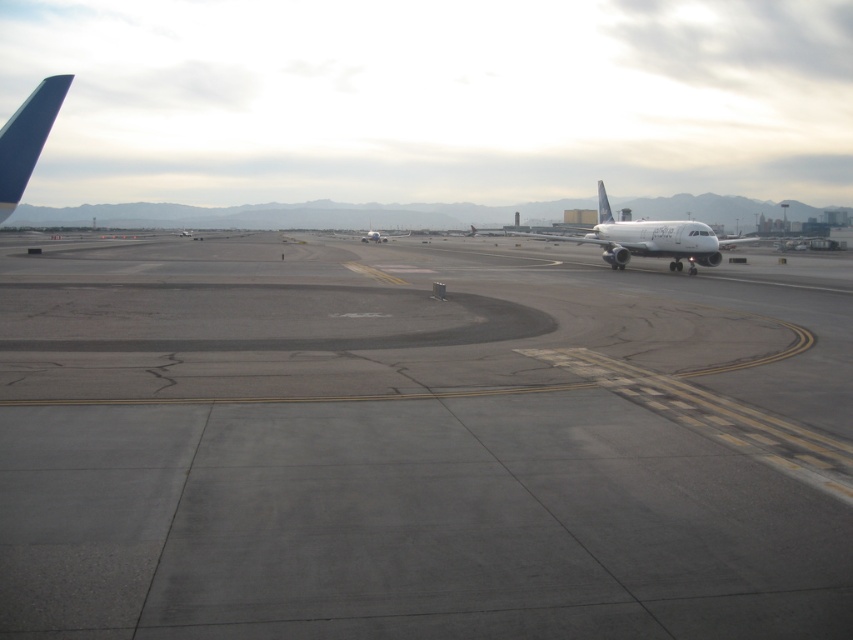
Does gray asphalt runway at center have a greater height compared to white glossy airplane at center?

No.

How distant is gray asphalt runway at center from white glossy airplane at center?

gray asphalt runway at center is 49.11 feet away from white glossy airplane at center.

At what (x,y) coordinates should I click in order to perform the action: click on gray asphalt runway at center. Please return your answer as a coordinate pair (x, y). The image size is (853, 640). Looking at the image, I should click on (419, 442).

This screenshot has height=640, width=853. Find the location of `gray asphalt runway at center`. gray asphalt runway at center is located at coordinates point(419,442).